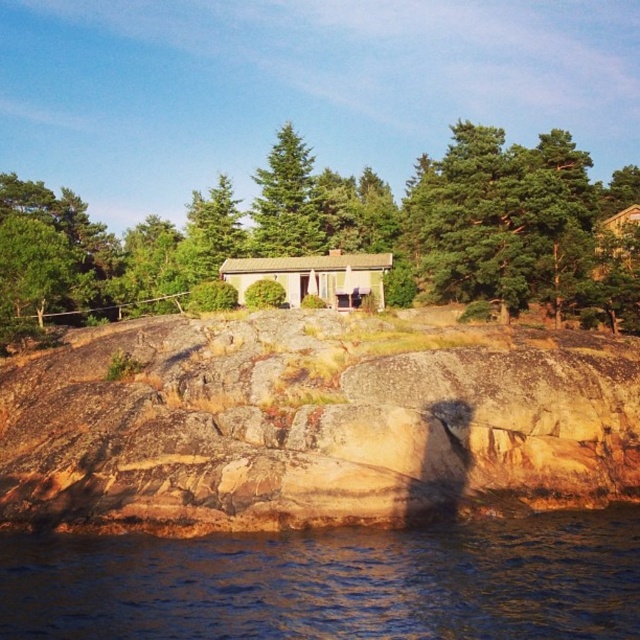
Question: Can you confirm if brown rough rock at center is bigger than blue water at lower left?

Choices:
 (A) no
 (B) yes

Answer: (B)

Question: Is brown rough rock at center to the right of blue water at lower left from the viewer's perspective?

Choices:
 (A) no
 (B) yes

Answer: (A)

Question: Which of the following is the closest to the observer?

Choices:
 (A) (612, 236)
 (B) (285, 125)
 (C) (480, 468)

Answer: (C)

Question: Considering the relative positions of blue water at lower left and wooden cabin at upper center in the image provided, where is blue water at lower left located with respect to wooden cabin at upper center?

Choices:
 (A) above
 (B) below

Answer: (B)

Question: Which of these objects is positioned farthest from the green leafy tree at center?

Choices:
 (A) wooden cabin at upper center
 (B) green fir tree at center

Answer: (A)

Question: Among these points, which one is farthest from the camera?

Choices:
 (A) (168, 384)
 (B) (280, 154)
 (C) (3, 296)
 (D) (492, 634)

Answer: (B)